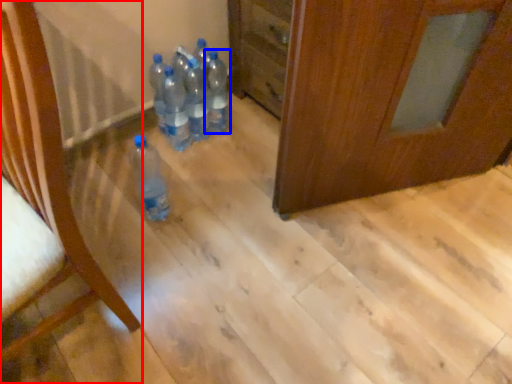
Question: Which object appears farthest to the camera in this image, furniture (highlighted by a red box) or bottle (highlighted by a blue box)?

Choices:
 (A) furniture
 (B) bottle

Answer: (B)